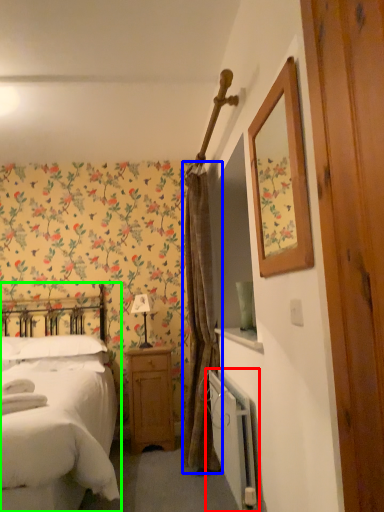
Question: Which object is positioned farthest from radiator (highlighted by a red box)? Select from curtain (highlighted by a blue box) and bed (highlighted by a green box).

Choices:
 (A) curtain
 (B) bed

Answer: (B)